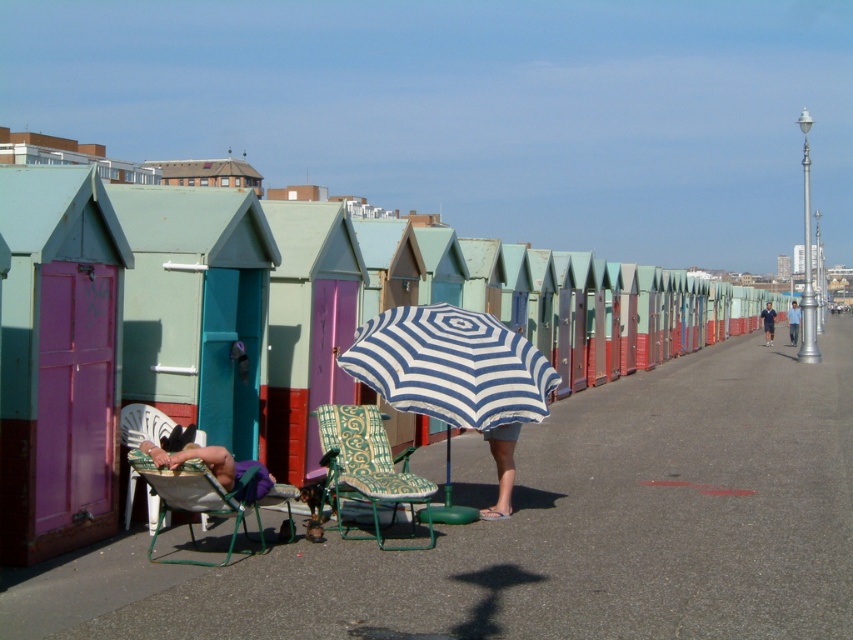
Question: Which object is positioned closest to the purple wood beach hut at left?

Choices:
 (A) white plastic chair at lower left
 (B) matte green skirt at center

Answer: (A)

Question: Is green fabric beach chair at center below white plastic chair at lower left?

Choices:
 (A) yes
 (B) no

Answer: (A)

Question: Which of the following is the closest to the observer?

Choices:
 (A) (769, 305)
 (B) (134, 420)

Answer: (B)

Question: Estimate the real-world distances between objects in this image. Which object is farther from the matte green skirt at center?

Choices:
 (A) white plastic chair at lower left
 (B) blue striped umbrella at center
 (C) striped fabric umbrella at center

Answer: (C)

Question: Does green fabric chair at lower left appear on the right side of matte green chair at lower left?

Choices:
 (A) no
 (B) yes

Answer: (B)

Question: Is purple wood beach hut at left positioned behind green fabric beach chair at center?

Choices:
 (A) no
 (B) yes

Answer: (A)